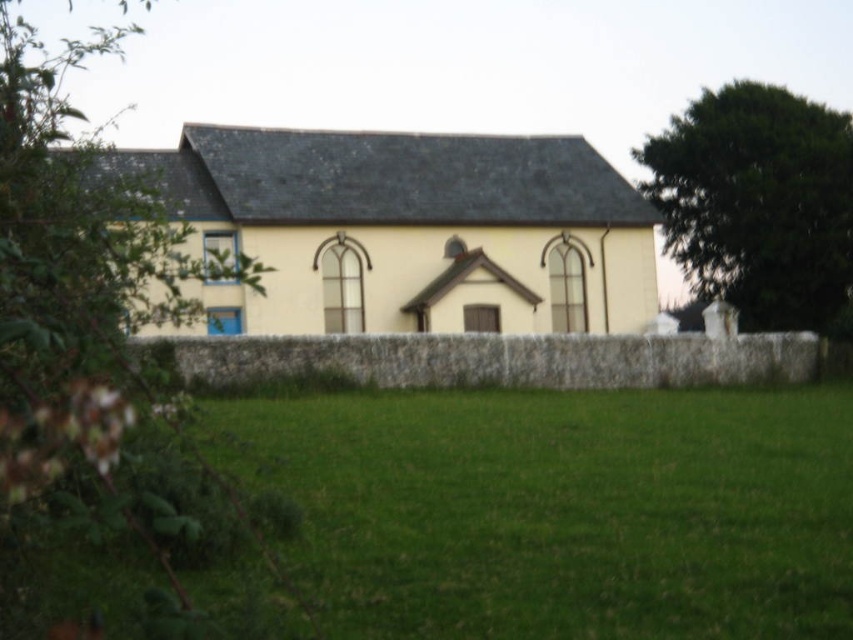
Question: Among these objects, which one is farthest from the camera?

Choices:
 (A) yellow matte church at center
 (B) green leafy tree at left

Answer: (A)

Question: Which object appears closest to the camera in this image?

Choices:
 (A) green leafy tree at left
 (B) yellow matte church at center
 (C) dark green leafy tree at upper right
 (D) green grass at lower center

Answer: (A)

Question: Does yellow matte church at center appear over dark green leafy tree at upper right?

Choices:
 (A) no
 (B) yes

Answer: (A)

Question: Does yellow matte church at center appear under green leafy tree at left?

Choices:
 (A) yes
 (B) no

Answer: (A)

Question: Which of the following is the closest to the observer?

Choices:
 (A) (115, 358)
 (B) (637, 544)
 (C) (738, 301)
 (D) (373, 308)

Answer: (A)

Question: In this image, where is green grass at lower center located relative to yellow matte church at center?

Choices:
 (A) left
 (B) right

Answer: (B)